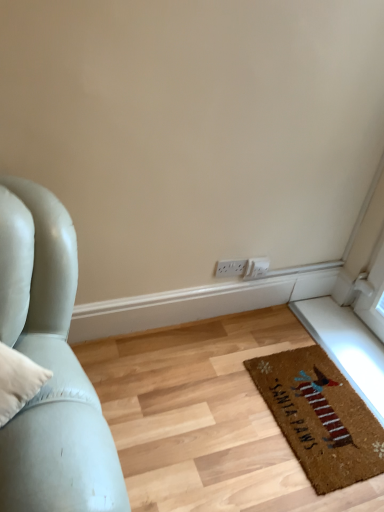
Locate an element on the screen. free area below brown coir mat at lower right (from a real-world perspective) is located at coordinates (323, 407).